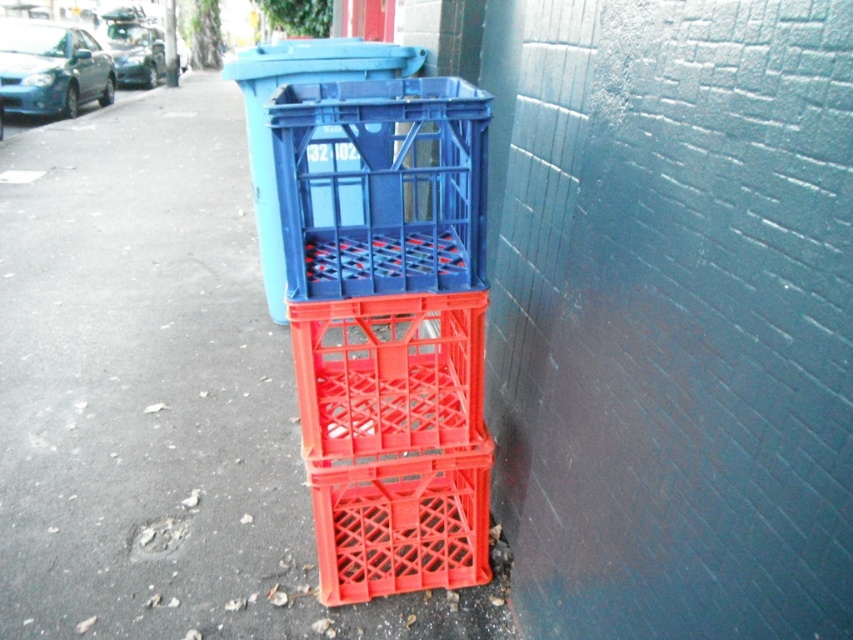
Does matte plastic crates at center have a larger size compared to blue plastic recycling bin at center?

Incorrect, matte plastic crates at center is not larger than blue plastic recycling bin at center.

Does point (4, 532) lie behind point (260, 240)?

No, it is in front of (260, 240).

The height and width of the screenshot is (640, 853). What do you see at coordinates (160, 397) in the screenshot?
I see `matte plastic crates at center` at bounding box center [160, 397].

Identify the location of matte plastic crates at center. (160, 397).